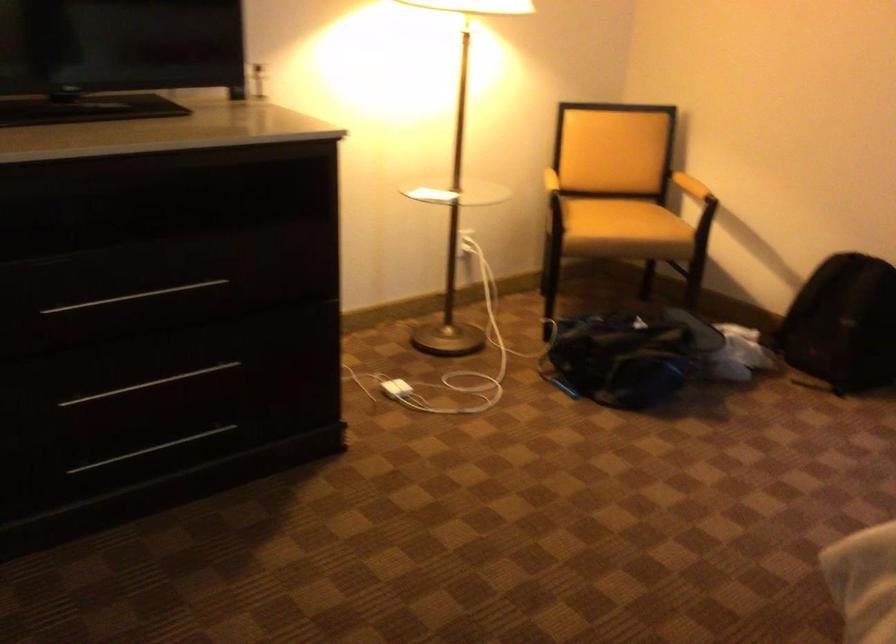
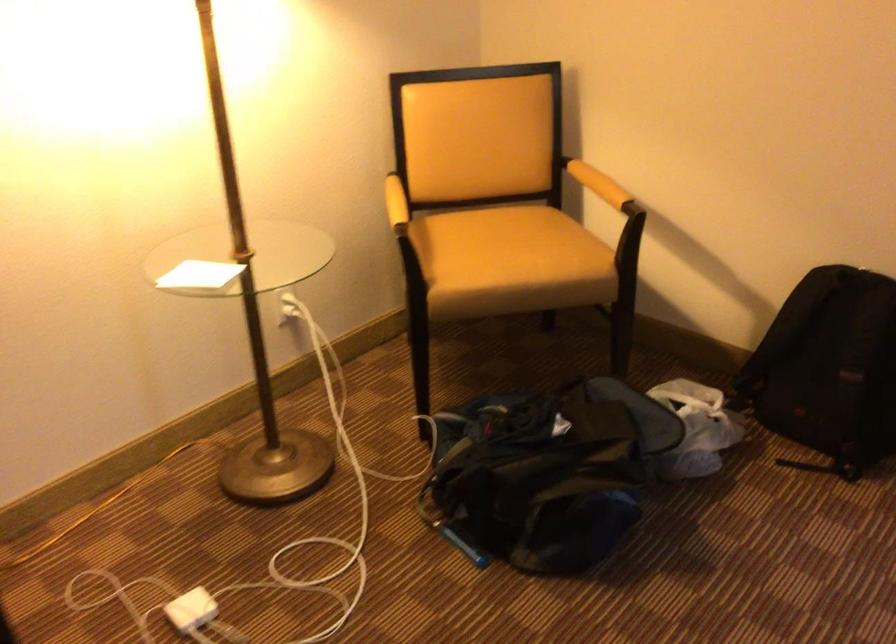
In the second image, find the point that corresponds to (683,176) in the first image.

(598, 184)